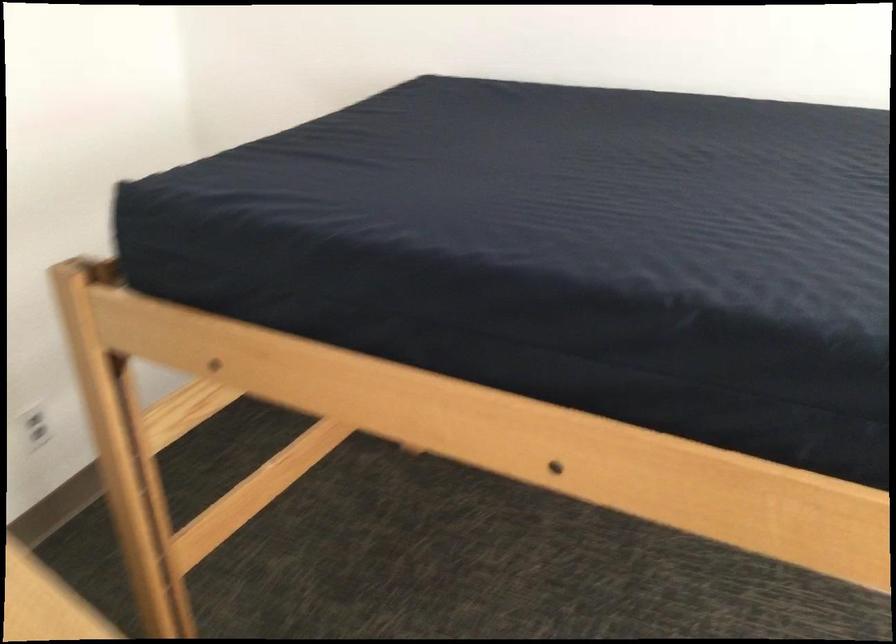
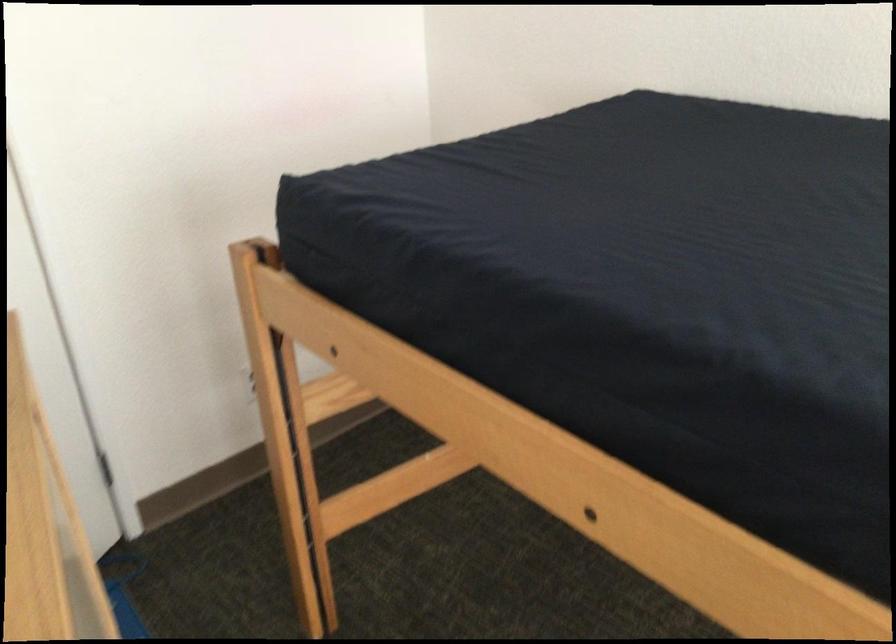
Where in the second image is the point corresponding to pixel 90 272 from the first image?

(262, 251)